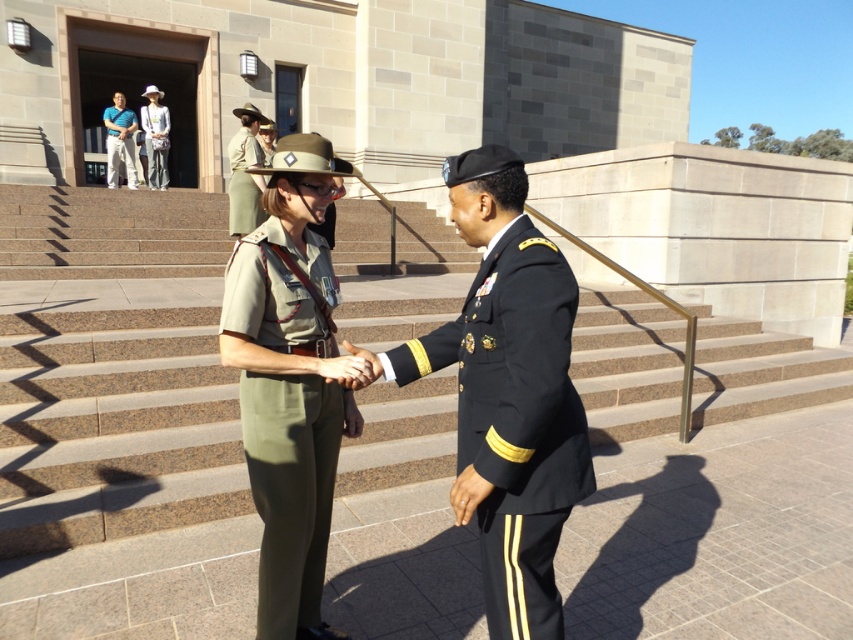
Does green fabric uniform at center have a larger size compared to blue cotton shirt at upper left?

No.

Where is `green fabric uniform at center`? The width and height of the screenshot is (853, 640). green fabric uniform at center is located at coordinates (289, 490).

This screenshot has height=640, width=853. I want to click on green fabric uniform at center, so click(x=289, y=490).

Can you confirm if brown stone stairs at center is bigger than green fabric uniform at center?

Yes.

Is brown stone stairs at center positioned in front of green fabric uniform at center?

No, it is behind green fabric uniform at center.

What do you see at coordinates (113, 426) in the screenshot?
I see `brown stone stairs at center` at bounding box center [113, 426].

This screenshot has height=640, width=853. Find the location of `brown stone stairs at center`. brown stone stairs at center is located at coordinates (113, 426).

Between shiny black uniform at center and blue cotton shirt at upper left, which one appears on the left side from the viewer's perspective?

blue cotton shirt at upper left is more to the left.

Is shiny black uniform at center to the right of blue cotton shirt at upper left from the viewer's perspective?

Yes, shiny black uniform at center is to the right of blue cotton shirt at upper left.

Looking at this image, who is more distant from viewer, (524,340) or (129,186)?

Positioned behind is point (129,186).

What are the coordinates of `shiny black uniform at center` in the screenshot? It's located at (514, 419).